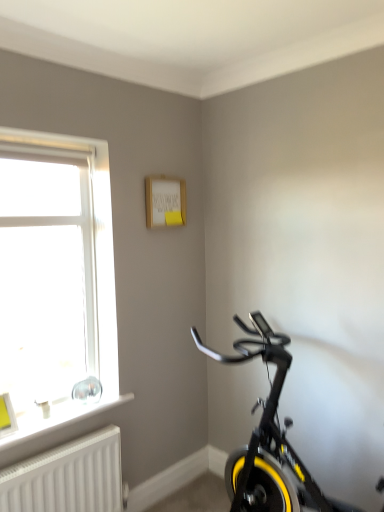
The image size is (384, 512). Identify the location of black matte exercise bike at lower right. (268, 437).

In the scene shown: In order to face yellow rubber bicycle wheel at lower right, should I rotate leftwards or rightwards?

A 9.262 degree turn to the right will do.

This screenshot has width=384, height=512. Identify the location of black matte exercise bike at lower right. [x=268, y=437].

Is yellow rubber bicycle wheel at lower right touching white plastic window sill at lower left?

yellow rubber bicycle wheel at lower right is not next to white plastic window sill at lower left, and they're not touching.

Considering the relative sizes of yellow rubber bicycle wheel at lower right and white plastic window sill at lower left in the image provided, is yellow rubber bicycle wheel at lower right thinner than white plastic window sill at lower left?

Indeed, yellow rubber bicycle wheel at lower right has a lesser width compared to white plastic window sill at lower left.

From a real-world perspective, is yellow rubber bicycle wheel at lower right over white plastic window sill at lower left?

Incorrect, from a real-world perspective, yellow rubber bicycle wheel at lower right is lower than white plastic window sill at lower left.

From the image's perspective, is yellow rubber bicycle wheel at lower right below white plastic window sill at lower left?

Correct, yellow rubber bicycle wheel at lower right appears lower than white plastic window sill at lower left in the image.

Is yellow rubber bicycle wheel at lower right with white textured radiator at lower left?

yellow rubber bicycle wheel at lower right and white textured radiator at lower left are clearly separated.

In the scene shown: From the image's perspective, which object appears higher, yellow rubber bicycle wheel at lower right or white textured radiator at lower left?

white textured radiator at lower left, from the image's perspective.

Can you tell me how much yellow rubber bicycle wheel at lower right and white textured radiator at lower left differ in facing direction?

yellow rubber bicycle wheel at lower right and white textured radiator at lower left are facing 90 degrees away from each other.

From the picture: Is yellow rubber bicycle wheel at lower right not inside white textured radiator at lower left?

Yes, yellow rubber bicycle wheel at lower right is not within white textured radiator at lower left.

Based on the photo, from a real-world perspective, who is located higher, yellow rubber bicycle wheel at lower right or white plastic window at left?

From a 3D spatial view, white plastic window at left is above.

Is yellow rubber bicycle wheel at lower right turned away from white plastic window at left?

No, white plastic window at left is not at the back of yellow rubber bicycle wheel at lower right.

In the scene shown: From the image's perspective, which one is positioned lower, yellow rubber bicycle wheel at lower right or white plastic window at left?

yellow rubber bicycle wheel at lower right, from the image's perspective.

In the scene shown: Between yellow rubber bicycle wheel at lower right and white plastic window at left, which one has smaller width?

yellow rubber bicycle wheel at lower right is thinner.

In the scene shown: Is white textured radiator at lower left with white plastic window sill at lower left?

No, white textured radiator at lower left is not in contact with white plastic window sill at lower left.

Which is farther from the camera, (46, 470) or (31, 418)?

The point (31, 418) is more distant.

Looking at their sizes, would you say white textured radiator at lower left is wider or thinner than white plastic window sill at lower left?

Considering their sizes, white textured radiator at lower left looks slimmer than white plastic window sill at lower left.

Is white plastic window at left wider than yellow rubber bicycle wheel at lower right?

Yes.

Considering the sizes of objects white plastic window at left and yellow rubber bicycle wheel at lower right in the image provided, who is smaller, white plastic window at left or yellow rubber bicycle wheel at lower right?

With smaller size is yellow rubber bicycle wheel at lower right.

At what (x,y) coordinates should I click in order to perform the action: click on bicycle wheel on the right side of white plastic window at left. Please return your answer as a coordinate pair (x, y). The width and height of the screenshot is (384, 512). Looking at the image, I should click on (268, 488).

Is point (20, 423) closer or farther from the camera than point (234, 466)?

Point (20, 423) is positioned closer to the camera compared to point (234, 466).

Between white textured radiator at lower left and black matte exercise bike at lower right, which one has smaller size?

Smaller between the two is white textured radiator at lower left.

Considering the sizes of objects white textured radiator at lower left and black matte exercise bike at lower right in the image provided, who is wider, white textured radiator at lower left or black matte exercise bike at lower right?

Wider between the two is black matte exercise bike at lower right.

From a real-world perspective, is white textured radiator at lower left physically located above or below black matte exercise bike at lower right?

In terms of real-world spatial position, white textured radiator at lower left is below black matte exercise bike at lower right.

Is point (82, 445) positioned before point (251, 490)?

Yes, it is in front of point (251, 490).

Is white plastic window sill at lower left surrounding white plastic window at left?

No, white plastic window at left is located outside of white plastic window sill at lower left.

Considering the relative positions of white plastic window sill at lower left and white plastic window at left in the image provided, is white plastic window sill at lower left to the right of white plastic window at left from the viewer's perspective?

Yes.

From the picture: Can you confirm if white plastic window sill at lower left is thinner than white plastic window at left?

No, white plastic window sill at lower left is not thinner than white plastic window at left.

I want to click on bicycle wheel on the right of white plastic window sill at lower left, so click(268, 488).

The image size is (384, 512). I want to click on radiator that is on the left side of yellow rubber bicycle wheel at lower right, so click(x=68, y=477).

Looking at the image, which one is located further to white plastic window at left, yellow rubber bicycle wheel at lower right or white plastic window sill at lower left?

Among the two, yellow rubber bicycle wheel at lower right is located further to white plastic window at left.

From the image, which object appears to be farther from white textured radiator at lower left, yellow rubber bicycle wheel at lower right or white plastic window sill at lower left?

Among the two, yellow rubber bicycle wheel at lower right is located further to white textured radiator at lower left.

Considering their positions, is white plastic window at left positioned further to yellow rubber bicycle wheel at lower right than white plastic window sill at lower left?

Based on the image, white plastic window at left appears to be further to yellow rubber bicycle wheel at lower right.

Estimate the real-world distances between objects in this image. Which object is further from white textured radiator at lower left, yellow rubber bicycle wheel at lower right or black matte exercise bike at lower right?

yellow rubber bicycle wheel at lower right lies further to white textured radiator at lower left than the other object.

Which object lies nearer to the anchor point yellow rubber bicycle wheel at lower right, white textured radiator at lower left or white plastic window at left?

white textured radiator at lower left lies closer to yellow rubber bicycle wheel at lower right than the other object.

Considering their positions, is white plastic window sill at lower left positioned further to white plastic window at left than white textured radiator at lower left?

white textured radiator at lower left lies further to white plastic window at left than the other object.

Which object lies nearer to the anchor point white textured radiator at lower left, white plastic window sill at lower left or yellow rubber bicycle wheel at lower right?

white plastic window sill at lower left is positioned closer to the anchor white textured radiator at lower left.

Based on the photo, which object lies further to the anchor point white plastic window at left, white plastic window sill at lower left or black matte exercise bike at lower right?

Among the two, black matte exercise bike at lower right is located further to white plastic window at left.

Where is `radiator located between white plastic window sill at lower left and black matte exercise bike at lower right in the left-right direction`? radiator located between white plastic window sill at lower left and black matte exercise bike at lower right in the left-right direction is located at coordinates (68, 477).

What are the coordinates of `window sill between white plastic window at left and white textured radiator at lower left from top to bottom` in the screenshot? It's located at pyautogui.click(x=54, y=417).

Image resolution: width=384 pixels, height=512 pixels. I want to click on bicycle wheel between white plastic window sill at lower left and black matte exercise bike at lower right from left to right, so click(268, 488).

Locate an element on the screen. radiator between white plastic window at left and yellow rubber bicycle wheel at lower right in the vertical direction is located at coordinates click(x=68, y=477).